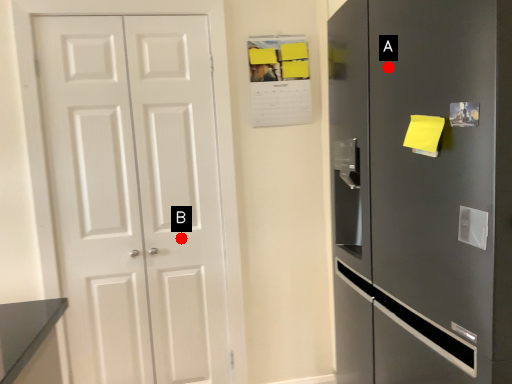
Question: Two points are circled on the image, labeled by A and B beside each circle. Which point appears farthest from the camera in this image?

Choices:
 (A) A is further
 (B) B is further

Answer: (B)